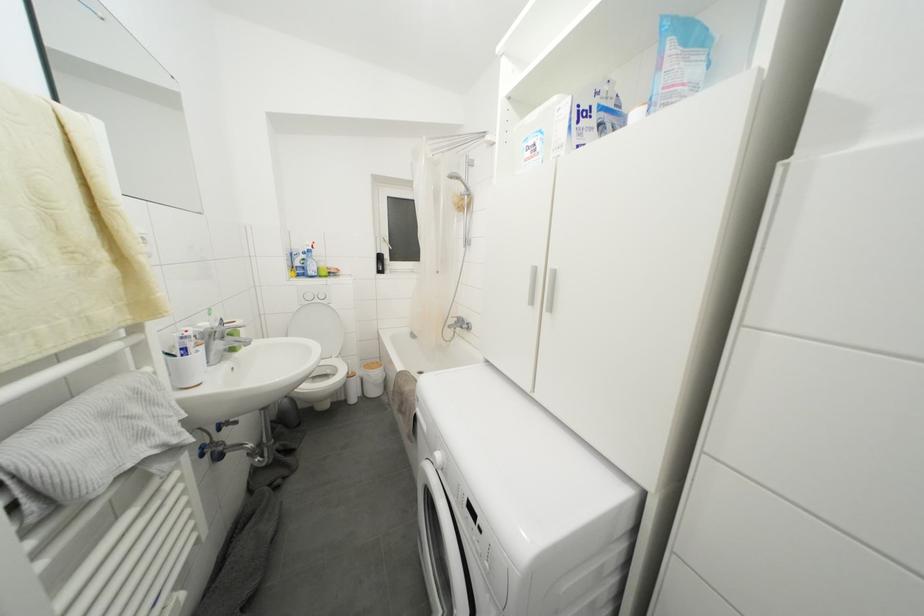
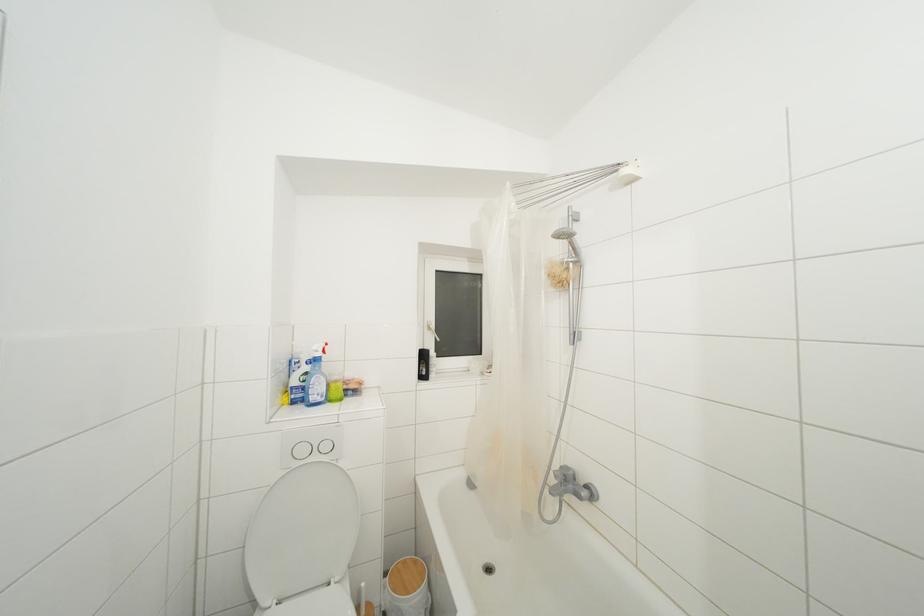
In the second image, find the point that corresponds to (x=383, y=262) in the first image.

(428, 361)